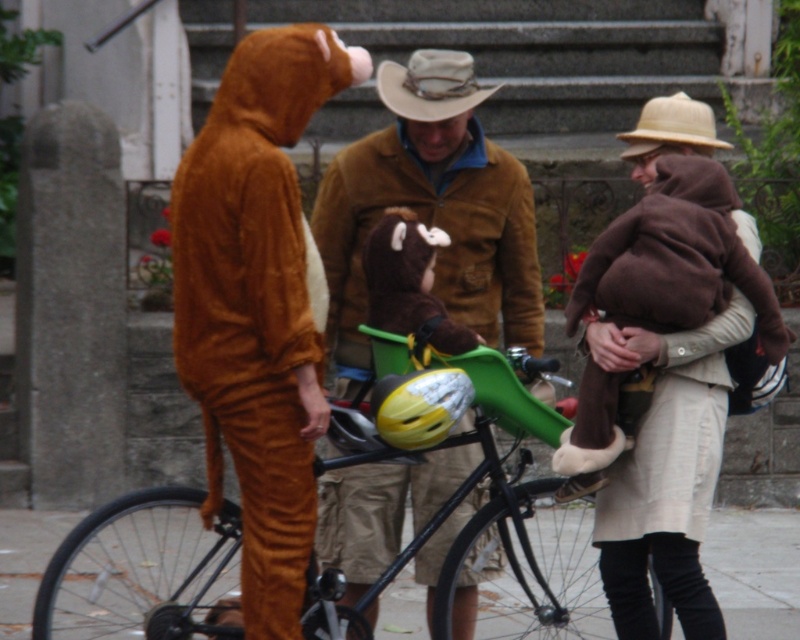
You are a photographer trying to capture a group photo of the people in the scene. You notice the brown plush bear at center and the brown felt cowboy hat at upper center. Which object should you adjust to ensure both are fully visible in the frame?

Since the brown plush bear at center is wider than the brown felt cowboy hat at upper center, you should adjust the camera angle or zoom to accommodate the width of the brown plush bear at center to ensure both are fully visible.

You are standing at the origin point in the scene. Which direction should you move to reach the brown plush bear at center?

The brown plush bear at center is located at coordinates approximately 0.441 on the x axis and 0.511 on the y axis, so you should move northeast to reach it.